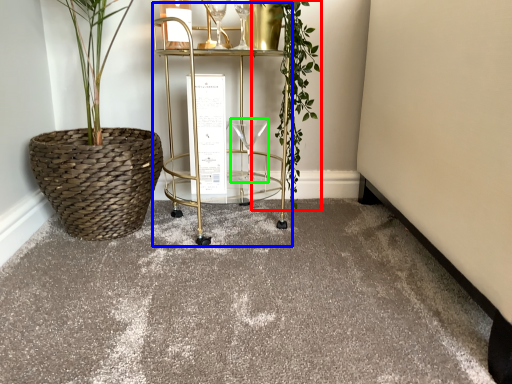
Question: Estimate the real-world distances between objects in this image. Which object is farther from vegetation (highlighted by a red box), cart (highlighted by a blue box) or wine glass (highlighted by a green box)?

Choices:
 (A) cart
 (B) wine glass

Answer: (B)